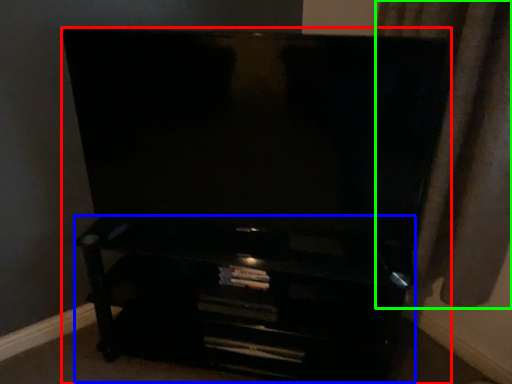
Question: Which is farther away from furniture (highlighted by a red box)? entertainment center (highlighted by a blue box) or curtain (highlighted by a green box)?

Choices:
 (A) entertainment center
 (B) curtain

Answer: (B)